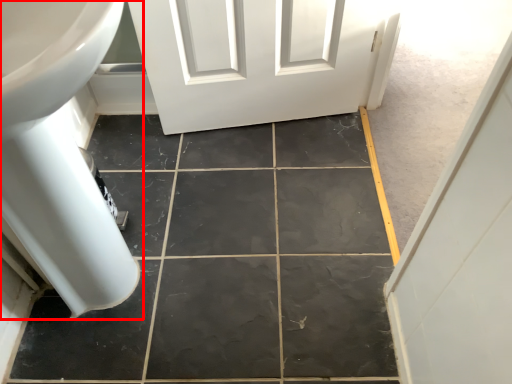
Question: From the image's perspective, where is bath (annotated by the red box) located in relation to ceramic tile in the image?

Choices:
 (A) above
 (B) below

Answer: (A)